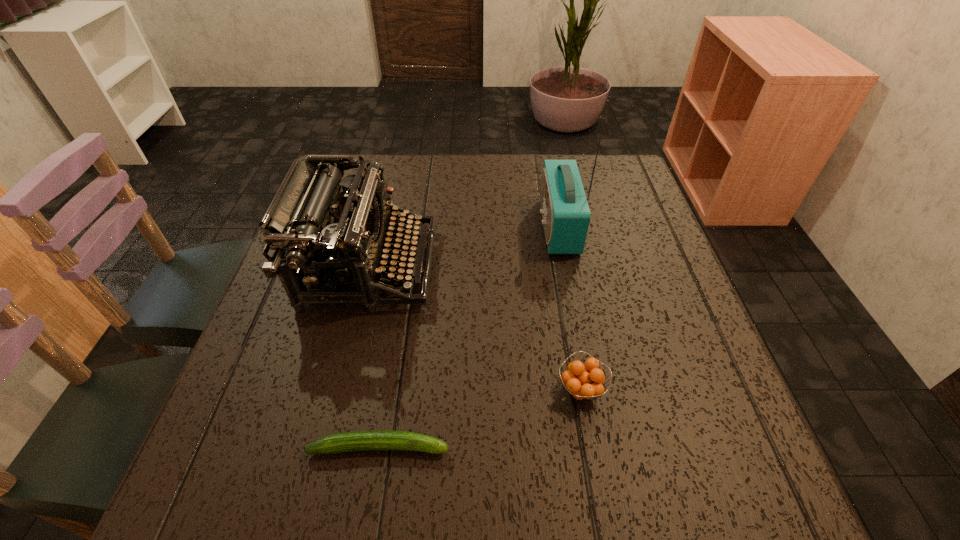
Identify the location of blank space located on the left of the second nearest object. This screenshot has width=960, height=540. (390, 389).

Where is `vacant space located 0.150m on the front-facing side of the shortest object`? This screenshot has height=540, width=960. vacant space located 0.150m on the front-facing side of the shortest object is located at coordinates (540, 447).

The width and height of the screenshot is (960, 540). I want to click on object located at the far edge, so click(565, 212).

I want to click on object located at the near edge, so click(x=358, y=440).

Where is `object that is at the left edge`? The height and width of the screenshot is (540, 960). object that is at the left edge is located at coordinates (309, 224).

At what (x,y) coordinates should I click in order to perform the action: click on free spot at the far edge of the desktop. Please return your answer as a coordinate pair (x, y). Looking at the image, I should click on (483, 171).

Where is `vacant space at the near edge of the desktop`? Image resolution: width=960 pixels, height=540 pixels. vacant space at the near edge of the desktop is located at coordinates (437, 476).

In the image, there is a desktop. Identify the location of vacant space at the left edge. The image size is (960, 540). (280, 336).

In order to click on vacant region at the right edge of the desktop in this screenshot , I will do `click(637, 277)`.

In the image, there is a desktop. Identify the location of vacant space at the near right corner. This screenshot has width=960, height=540. (716, 471).